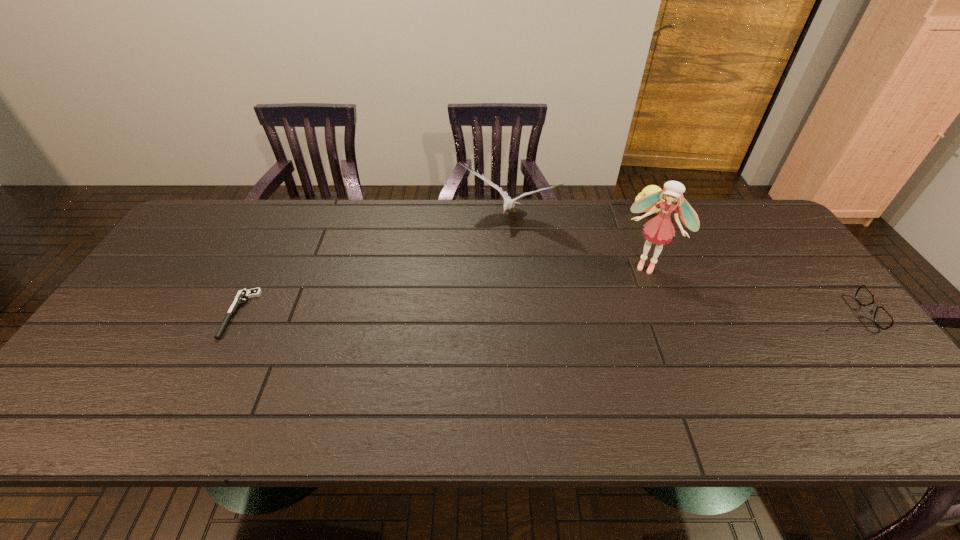
Where is `vacant space located 0.200m on the front-facing side of the doll`? vacant space located 0.200m on the front-facing side of the doll is located at coordinates (616, 323).

Image resolution: width=960 pixels, height=540 pixels. I want to click on vacant space located 0.280m on the front-facing side of the doll, so click(606, 345).

Locate an element on the screen. This screenshot has height=540, width=960. vacant region located on the front-facing side of the doll is located at coordinates pyautogui.click(x=609, y=340).

This screenshot has height=540, width=960. I want to click on free location located at the tip of the beak of the gull, so click(x=452, y=301).

This screenshot has width=960, height=540. Identify the location of free point located 0.060m at the tip of the beak of the gull. (486, 242).

This screenshot has height=540, width=960. Find the location of `free region located at the tip of the beak of the gull`. free region located at the tip of the beak of the gull is located at coordinates (476, 259).

Where is `free point located 0.240m at the beak of the third shortest object`? This screenshot has width=960, height=540. free point located 0.240m at the beak of the third shortest object is located at coordinates (630, 263).

Identify the location of vacant space located at the beak of the third shortest object. The image size is (960, 540). (631, 259).

Where is `free spot located at the beak of the third shortest object`? The height and width of the screenshot is (540, 960). free spot located at the beak of the third shortest object is located at coordinates (634, 253).

This screenshot has width=960, height=540. Find the location of `gull present at the far edge`. gull present at the far edge is located at coordinates (509, 203).